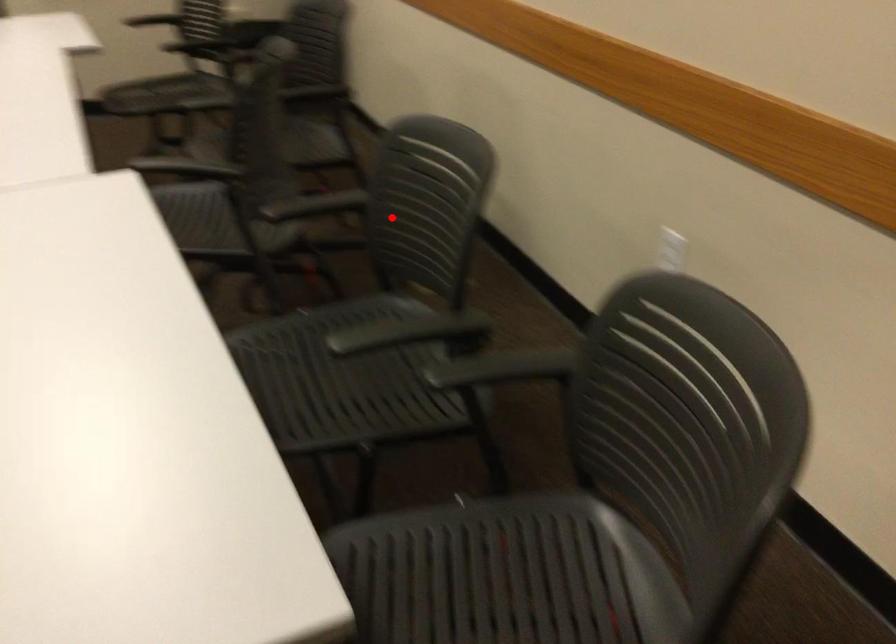
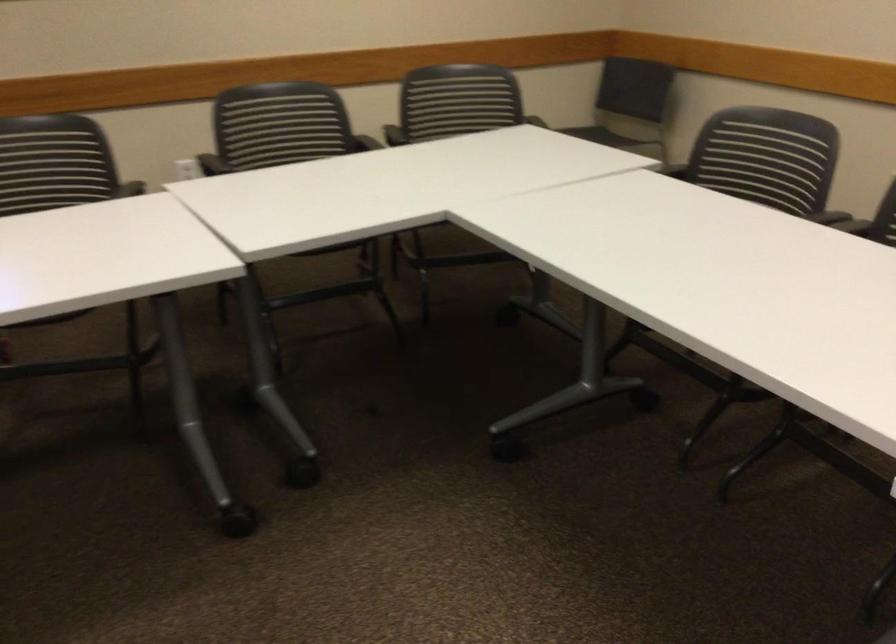
Question: A red point is marked in image1. In image2, is the corresponding 3D point closer to the camera or farther? Reply with the corresponding letter.

Choices:
 (A) The corresponding 3D point is closer.
 (B) The corresponding 3D point is farther.

Answer: (B)